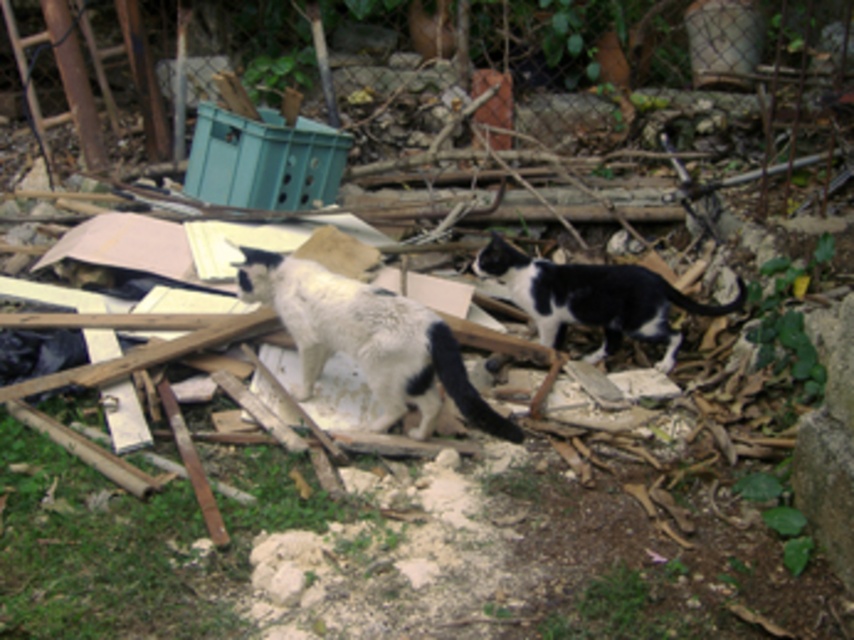
Question: Which of the following is the farthest from the observer?

Choices:
 (A) white fur cat at center
 (B) black and white fur cat at center

Answer: (B)

Question: Is white fur cat at center above black and white fur cat at center?

Choices:
 (A) yes
 (B) no

Answer: (B)

Question: Where is white fur cat at center located in relation to black and white fur cat at center in the image?

Choices:
 (A) below
 (B) above

Answer: (A)

Question: Which point is farther from the camera taking this photo?

Choices:
 (A) (604, 304)
 (B) (253, 250)

Answer: (A)

Question: Is the position of white fur cat at center more distant than that of black and white fur cat at center?

Choices:
 (A) yes
 (B) no

Answer: (B)

Question: Which point is farther to the camera?

Choices:
 (A) (295, 321)
 (B) (488, 256)

Answer: (B)